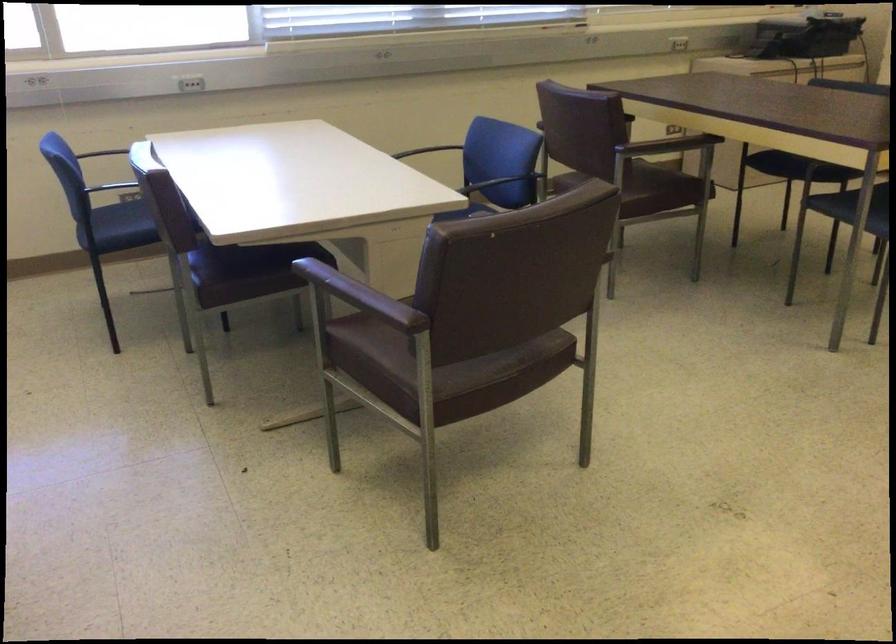
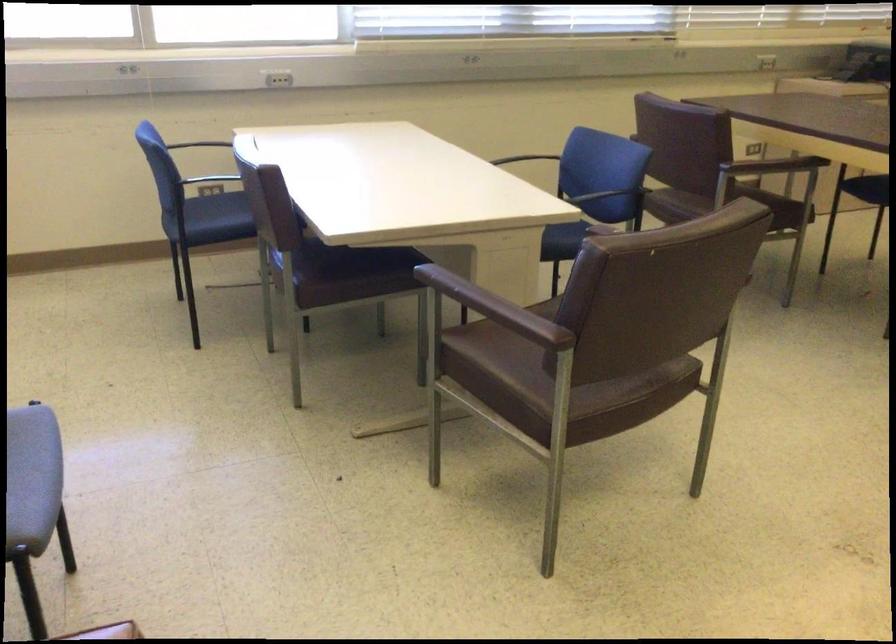
Locate, in the second image, the point that corresponds to (x=325, y=279) in the first image.

(453, 287)